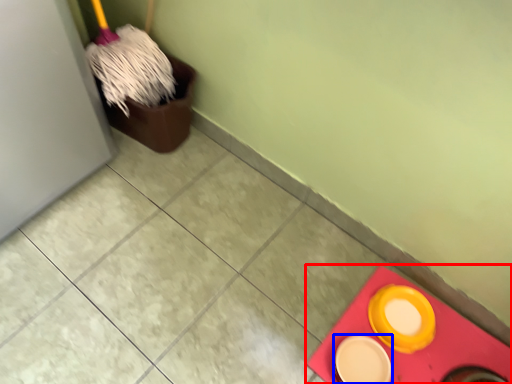
Question: Which object is further to the camera taking this photo, tile (highlighted by a red box) or tableware (highlighted by a blue box)?

Choices:
 (A) tile
 (B) tableware

Answer: (B)